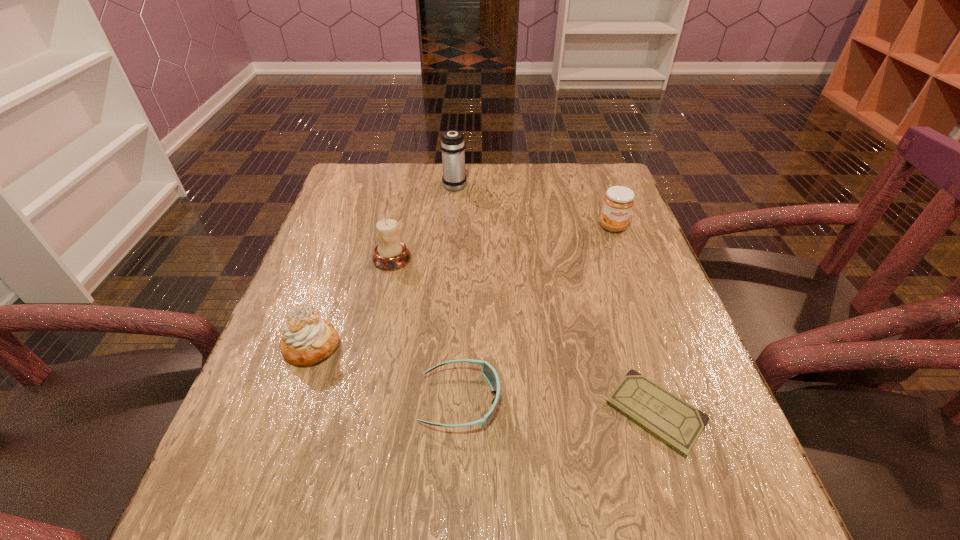
Find the location of a particular element. vacant space at the left edge of the desktop is located at coordinates (347, 308).

Where is `vacant space at the right edge of the desktop`? The width and height of the screenshot is (960, 540). vacant space at the right edge of the desktop is located at coordinates pos(607,286).

You are a GUI agent. You are given a task and a screenshot of the screen. Output one action in this format:
    pyautogui.click(x=<x>, y=<y>)
    Task: Click on the free region at the far left corner of the desktop
    
    Given the screenshot: What is the action you would take?
    pyautogui.click(x=336, y=196)

The height and width of the screenshot is (540, 960). I want to click on free space at the far right corner of the desktop, so click(x=563, y=174).

At what (x,y) coordinates should I click in order to perform the action: click on free space at the near right corner of the desktop. Please return your answer as a coordinate pair (x, y). This screenshot has height=540, width=960. Looking at the image, I should click on (746, 520).

I want to click on free space between the checkbook and the fourth nearest object, so click(524, 335).

The height and width of the screenshot is (540, 960). Find the location of `unoccupied area between the checkbook and the goggles`. unoccupied area between the checkbook and the goggles is located at coordinates (558, 407).

Where is `free space between the shortest object and the second object from left to right`? free space between the shortest object and the second object from left to right is located at coordinates (524, 335).

Image resolution: width=960 pixels, height=540 pixels. In order to click on free area in between the jam and the fifth tallest object in this screenshot , I will do `click(537, 314)`.

Identify the location of vacant space in between the tallest object and the jam. (534, 206).